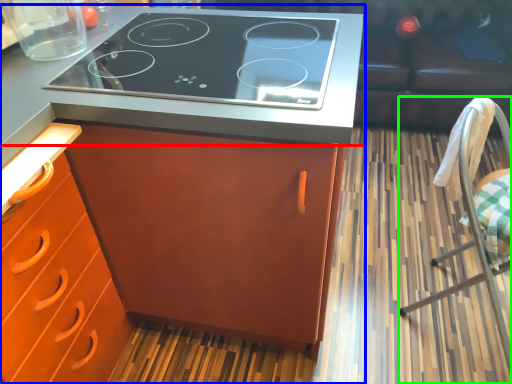
Question: Based on their relative distances, which object is farther from countertop (highlighted by a red box)? Choose from cabinetry (highlighted by a blue box) and chair (highlighted by a green box).

Choices:
 (A) cabinetry
 (B) chair

Answer: (B)